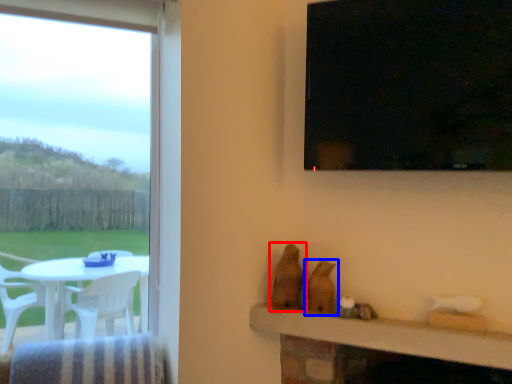
Question: Which of the following is the farthest to the observer, animal (highlighted by a red box) or animal (highlighted by a blue box)?

Choices:
 (A) animal
 (B) animal

Answer: (A)